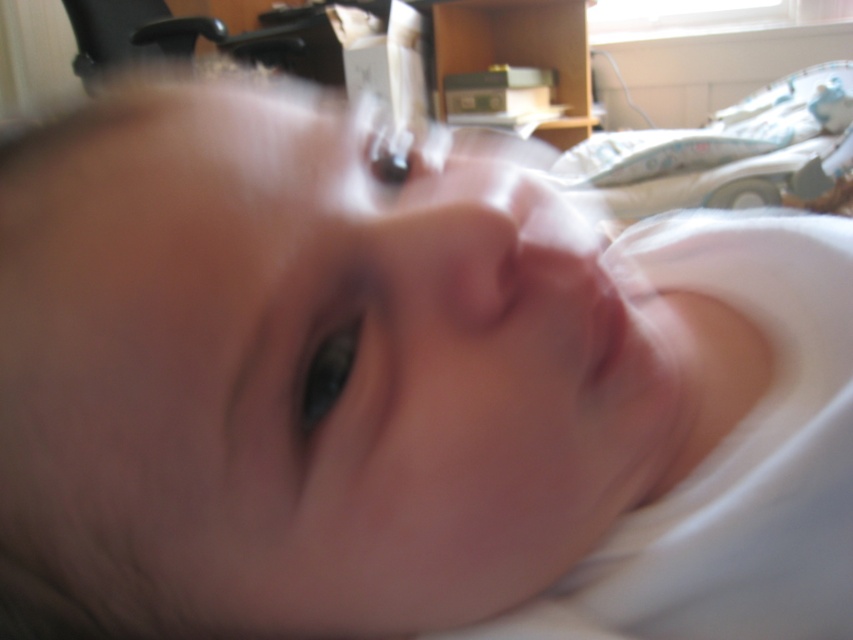
Which of these two, white fabric hospital bed at upper right or smooth flesh mouth at center, stands taller?

white fabric hospital bed at upper right is taller.

What do you see at coordinates (711, 150) in the screenshot?
I see `white fabric hospital bed at upper right` at bounding box center [711, 150].

Where is `white fabric hospital bed at upper right`? Image resolution: width=853 pixels, height=640 pixels. white fabric hospital bed at upper right is located at coordinates (711, 150).